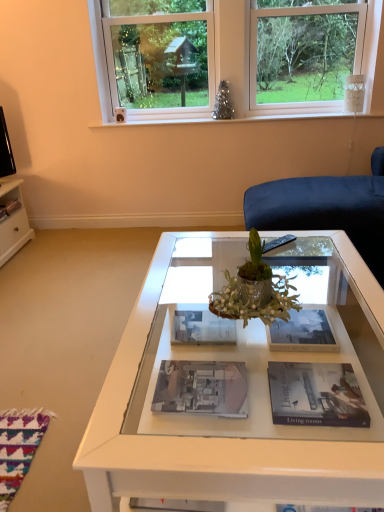
Find the location of a particular element. The image size is (384, 512). free point above matte paper magazine at center, acting as the 2th magazine starting from the right (from a real-world perspective) is located at coordinates (311, 392).